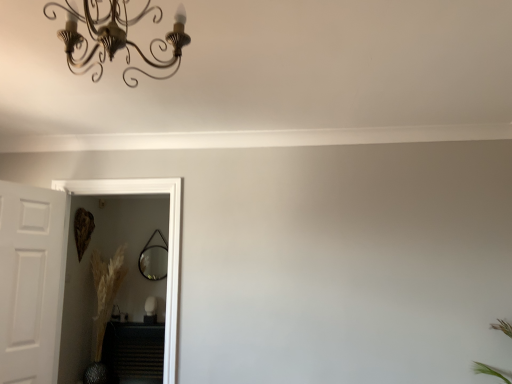
Question: From a real-world perspective, is white matte door at left positioned under clear glass door at left based on gravity?

Choices:
 (A) no
 (B) yes

Answer: (B)

Question: Is white matte door at left facing away from clear glass door at left?

Choices:
 (A) yes
 (B) no

Answer: (B)

Question: Are white matte door at left and clear glass door at left making contact?

Choices:
 (A) no
 (B) yes

Answer: (A)

Question: Is the depth of white matte door at left greater than that of clear glass door at left?

Choices:
 (A) yes
 (B) no

Answer: (B)

Question: Is white matte door at left aimed at clear glass door at left?

Choices:
 (A) yes
 (B) no

Answer: (B)

Question: Is white matte door at left completely or partially outside of clear glass door at left?

Choices:
 (A) no
 (B) yes

Answer: (B)

Question: From the image's perspective, is clear glass door at left under matte black mirror at center?

Choices:
 (A) no
 (B) yes

Answer: (A)

Question: Considering the relative sizes of clear glass door at left and matte black mirror at center in the image provided, is clear glass door at left smaller than matte black mirror at center?

Choices:
 (A) yes
 (B) no

Answer: (B)

Question: Is clear glass door at left oriented towards matte black mirror at center?

Choices:
 (A) yes
 (B) no

Answer: (B)

Question: Can you confirm if clear glass door at left is shorter than matte black mirror at center?

Choices:
 (A) no
 (B) yes

Answer: (A)

Question: Is clear glass door at left located outside matte black mirror at center?

Choices:
 (A) yes
 (B) no

Answer: (A)

Question: Does clear glass door at left appear on the left side of matte black mirror at center?

Choices:
 (A) yes
 (B) no

Answer: (B)

Question: Does white matte door at left have a lesser height compared to black matte radiator at lower left?

Choices:
 (A) no
 (B) yes

Answer: (A)